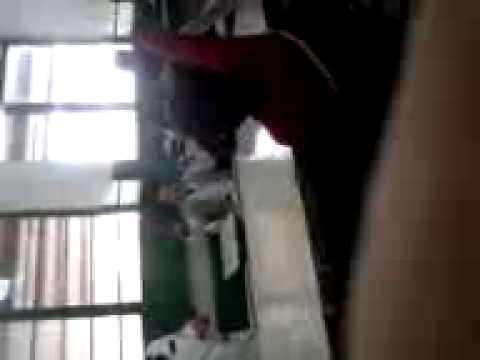
Where is `green wall under window`? Image resolution: width=480 pixels, height=360 pixels. green wall under window is located at coordinates (161, 273).